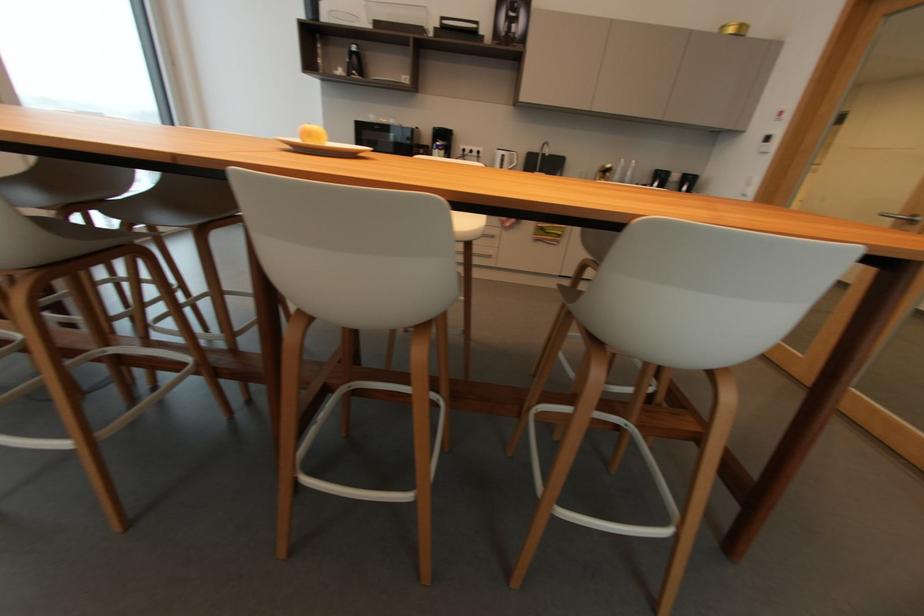
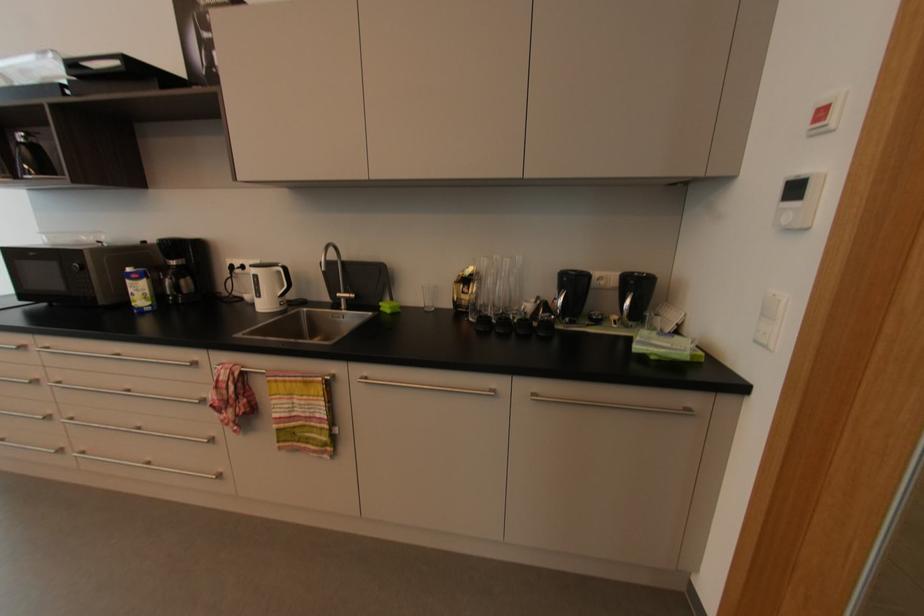
Where in the second image is the point corresponding to (x=748, y=196) from the first image?

(769, 347)